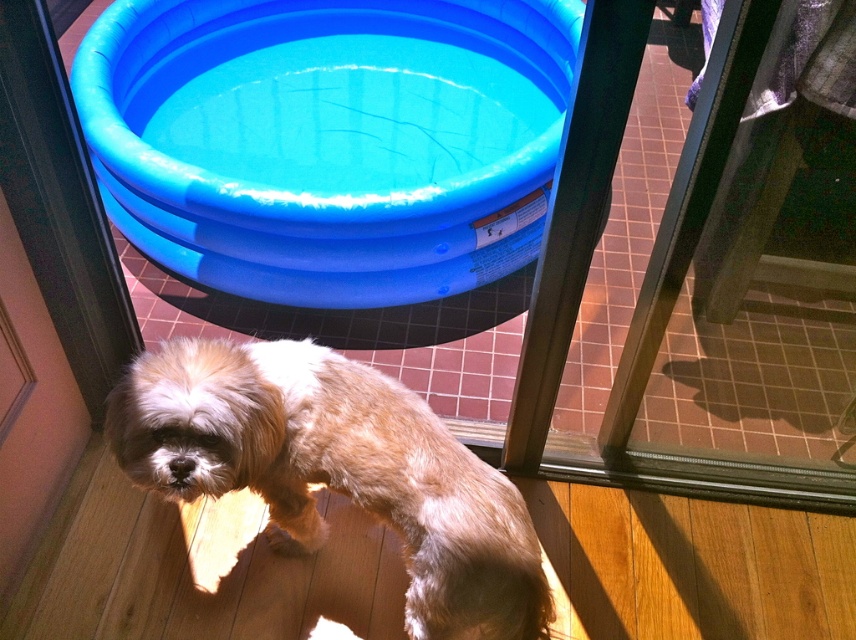
You are trying to locate the golden fur dog at center in the image. According to the coordinates provided, where is it positioned?

The golden fur dog at center is positioned at coordinates point (336, 470).

You are a visitor standing outside the glass door. You see the golden fur dog at center and the point marked at coordinate (x=336, y=470). Where is this point located on the dog?

The point marked at coordinate (x=336, y=470) is located on the golden fur dog at center.